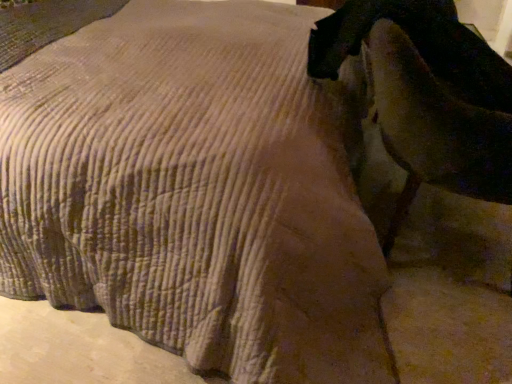
In order to click on velvet-like dark brown swivel chair at right in this screenshot , I will do `click(417, 47)`.

The width and height of the screenshot is (512, 384). Describe the element at coordinates (417, 47) in the screenshot. I see `velvet-like dark brown swivel chair at right` at that location.

This screenshot has height=384, width=512. What are the coordinates of `velvet-like dark brown swivel chair at right` in the screenshot? It's located at (417, 47).